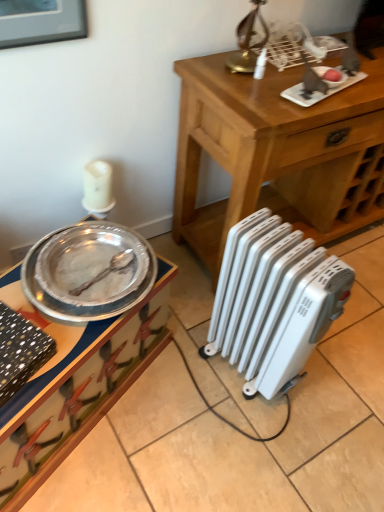
Question: Which is correct: wooden table at center is inside white plastic radiator at lower right, or outside of it?

Choices:
 (A) inside
 (B) outside

Answer: (B)

Question: From a real-world perspective, is wooden table at center physically located above or below white plastic radiator at lower right?

Choices:
 (A) below
 (B) above

Answer: (B)

Question: Considering the real-world distances, which object is farthest from the wooden table at center?

Choices:
 (A) metallic silver tray at left
 (B) brushed metal picture frame at upper left
 (C) white plastic radiator at lower right

Answer: (B)

Question: Which object is positioned closest to the brushed metal picture frame at upper left?

Choices:
 (A) metallic silver tray at left
 (B) wooden table at center
 (C) white plastic radiator at lower right

Answer: (B)